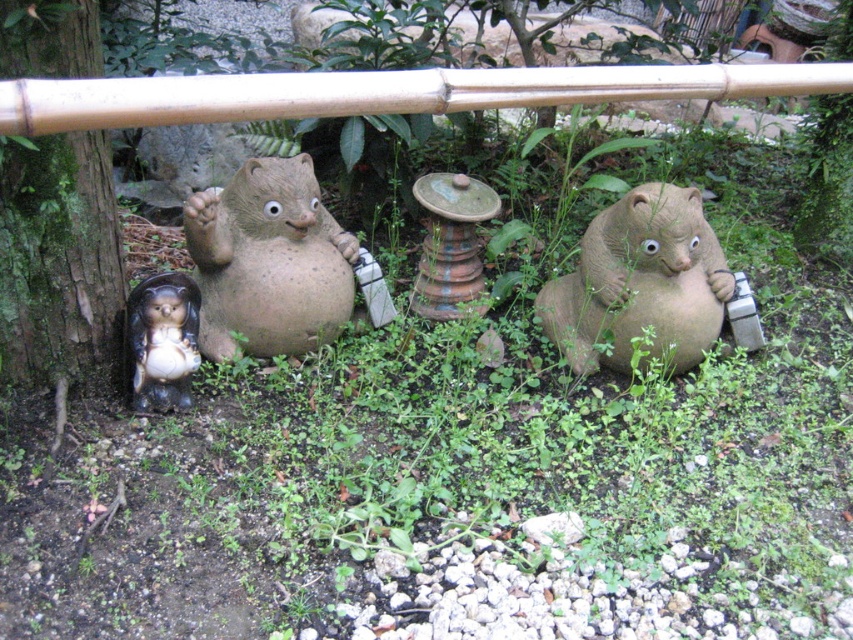
Does matte ceramic bear at center appear over glossy ceramic hedgehog at lower left?

Yes, matte ceramic bear at center is above glossy ceramic hedgehog at lower left.

Measure the distance between matte ceramic bear at center and glossy ceramic hedgehog at lower left.

matte ceramic bear at center and glossy ceramic hedgehog at lower left are 4.07 feet apart from each other.

This screenshot has height=640, width=853. I want to click on matte ceramic bear at center, so click(640, 282).

Locate an element on the screen. This screenshot has height=640, width=853. green mossy bark at left is located at coordinates (59, 259).

Based on the photo, is green mossy bark at left closer to the viewer compared to glossy ceramic hedgehog at lower left?

Yes, green mossy bark at left is in front of glossy ceramic hedgehog at lower left.

Image resolution: width=853 pixels, height=640 pixels. What do you see at coordinates (59, 259) in the screenshot? I see `green mossy bark at left` at bounding box center [59, 259].

This screenshot has width=853, height=640. What are the coordinates of `green mossy bark at left` in the screenshot? It's located at (59, 259).

Is point (276, 211) less distant than point (178, 355)?

No, (276, 211) is behind (178, 355).

Can you confirm if matte clay bear at center is positioned to the left of glossy ceramic hedgehog at lower left?

No, matte clay bear at center is not to the left of glossy ceramic hedgehog at lower left.

This screenshot has height=640, width=853. Identify the location of matte clay bear at center. (276, 262).